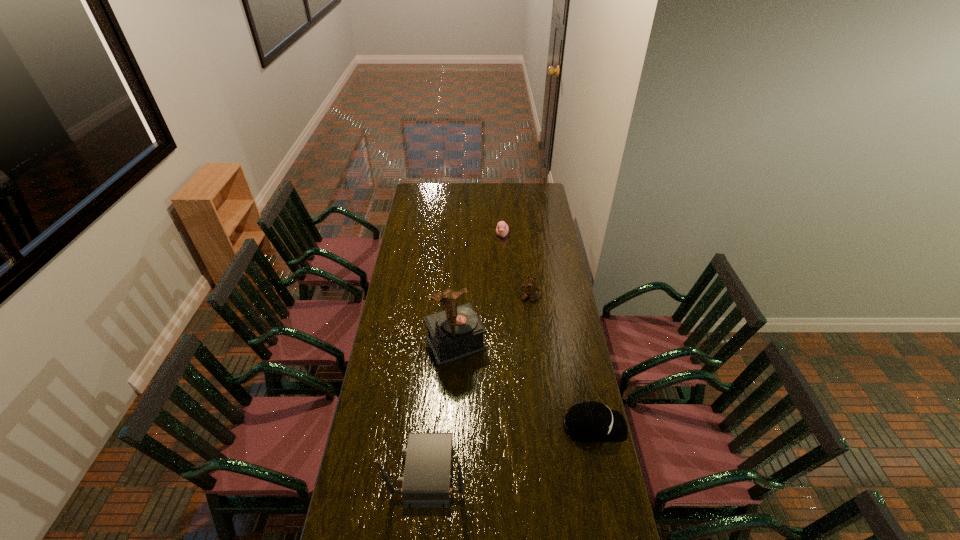
This screenshot has height=540, width=960. I want to click on teddy bear located at the right edge, so click(x=530, y=288).

I want to click on free space at the far edge, so click(472, 192).

At what (x,y) coordinates should I click in order to perform the action: click on vacant region at the left edge of the desktop. Please return your answer as a coordinate pair (x, y). The width and height of the screenshot is (960, 540). Looking at the image, I should click on [x=403, y=231].

In the image, there is a desktop. Find the location of `vacant space at the right edge`. vacant space at the right edge is located at coordinates (579, 458).

I want to click on free space at the far right corner of the desktop, so click(x=545, y=187).

At what (x,y) coordinates should I click in order to perform the action: click on free point between the phonograph_record and the cap. Please return your answer as a coordinate pair (x, y). The image size is (960, 540). Looking at the image, I should click on 525,385.

This screenshot has height=540, width=960. I want to click on vacant area between the third nearest object and the rightmost object, so click(525, 385).

The height and width of the screenshot is (540, 960). Identify the location of free space between the third farthest object and the second tallest object. (443, 407).

The width and height of the screenshot is (960, 540). Find the location of `free space between the router and the rightmost object`. free space between the router and the rightmost object is located at coordinates (512, 448).

The height and width of the screenshot is (540, 960). In order to click on vacant space that's between the third nearest object and the second farthest object in this screenshot , I will do `click(492, 320)`.